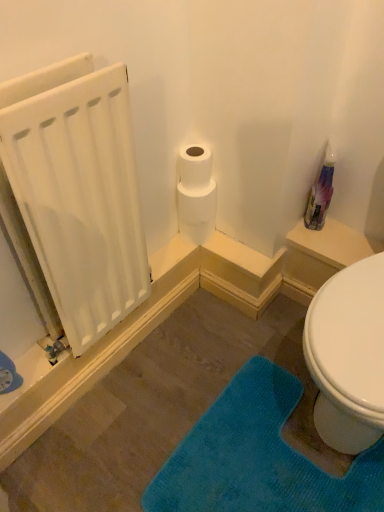
You are a GUI agent. You are given a task and a screenshot of the screen. Output one action in this format:
    pyautogui.click(x=<x>, y=<y>)
    Task: Click on the vacant space in front of translucent plastic spray bottle at upper right
    The image size is (384, 512).
    Given the screenshot: What is the action you would take?
    pyautogui.click(x=323, y=241)